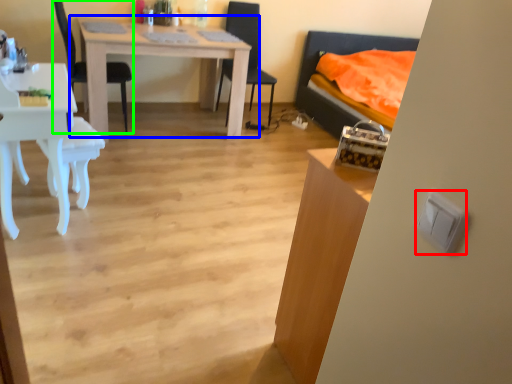
Question: Which is farther away from light switch (highlighted by a red box)? table (highlighted by a blue box) or chair (highlighted by a green box)?

Choices:
 (A) table
 (B) chair

Answer: (B)